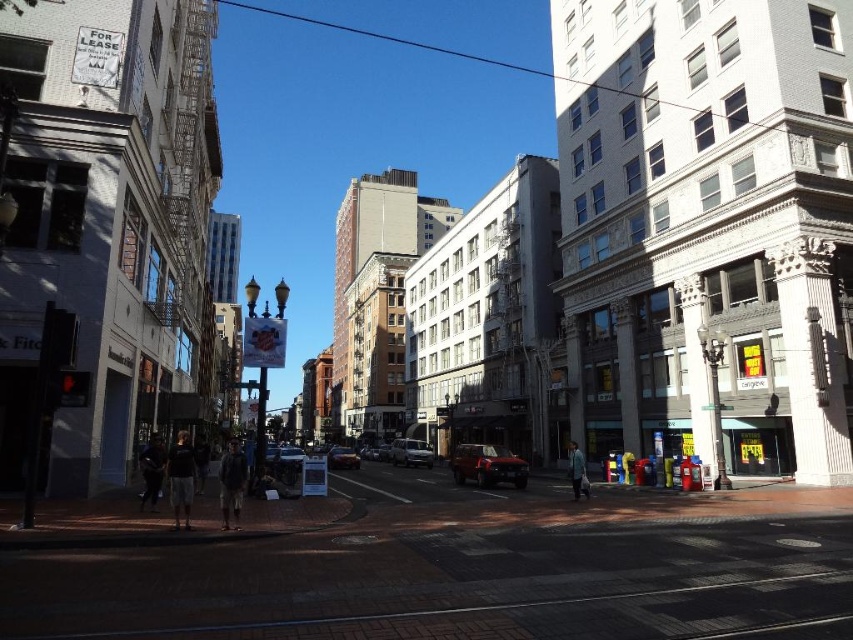
Question: Among these points, which one is nearest to the camera?

Choices:
 (A) (328, 465)
 (B) (486, 477)
 (C) (422, 461)

Answer: (B)

Question: Can you confirm if silver metallic sedan at center is wider than metallic silver car at center?

Choices:
 (A) yes
 (B) no

Answer: (B)

Question: Which point appears closest to the camera in this image?

Choices:
 (A) 341,468
 (B) 405,440
 (C) 524,472

Answer: (C)

Question: Which object is positioned farthest from the metallic silver car at center?

Choices:
 (A) silver metallic sedan at center
 (B) shiny dark red suv at center

Answer: (B)

Question: Can you confirm if shiny dark red suv at center is wider than silver metallic sedan at center?

Choices:
 (A) yes
 (B) no

Answer: (B)

Question: Does shiny dark red suv at center appear under metallic silver car at center?

Choices:
 (A) no
 (B) yes

Answer: (A)